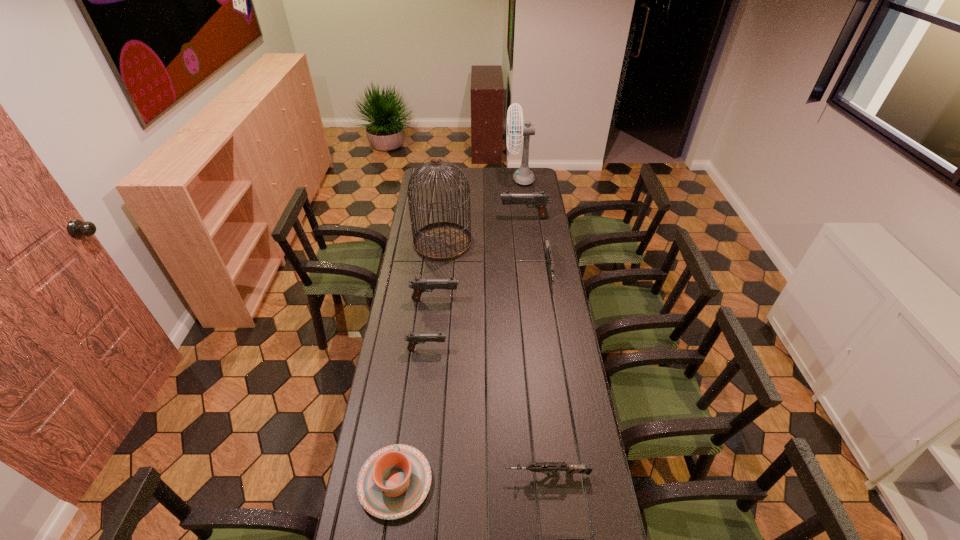
Locate an element on the screen. The image size is (960, 540). blank region between the farthest grey gun and the second nearest gray gun is located at coordinates pyautogui.click(x=492, y=284).

The height and width of the screenshot is (540, 960). I want to click on free space that is in between the farthest grey gun and the second farthest grey gun, so click(548, 372).

Where is `vacant region between the seventh shortest object and the smallest gray gun`? The width and height of the screenshot is (960, 540). vacant region between the seventh shortest object and the smallest gray gun is located at coordinates (476, 284).

Find the location of a particular element. free point between the pink chinaware and the birdcage is located at coordinates (419, 362).

The width and height of the screenshot is (960, 540). Find the location of `free spot between the second shortest gun and the farthest object`. free spot between the second shortest gun and the farthest object is located at coordinates (534, 327).

Where is `free area in between the pink chinaware and the second smallest grey gun`? free area in between the pink chinaware and the second smallest grey gun is located at coordinates (471, 479).

Find the location of a particular element. The width and height of the screenshot is (960, 540). free area in between the second farthest gun and the seventh shortest object is located at coordinates (537, 243).

The height and width of the screenshot is (540, 960). I want to click on object identified as the closest to the nearest gun, so click(x=553, y=467).

The width and height of the screenshot is (960, 540). I want to click on object that is the second closest to the fifth farthest object, so click(413, 338).

Locate an element on the screen. gun object that ranks as the third closest to the farthest gray gun is located at coordinates (413, 338).